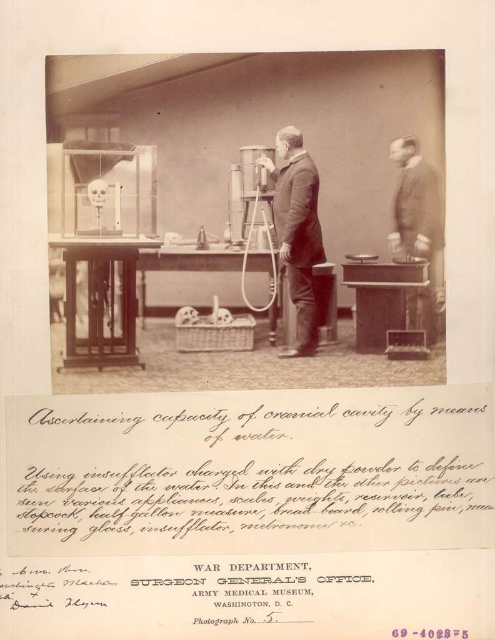
Question: Which is farther from the matte black box at center?

Choices:
 (A) smooth suit at center
 (B) matte black suit at right

Answer: (A)

Question: Does smooth suit at center appear on the left side of matte black box at center?

Choices:
 (A) no
 (B) yes

Answer: (B)

Question: In this image, where is smooth suit at center located relative to matte black box at center?

Choices:
 (A) right
 (B) left

Answer: (B)

Question: Which point is closer to the camera?

Choices:
 (A) (442, 301)
 (B) (306, 164)
 (C) (410, 314)

Answer: (A)

Question: Which object is closer to the camera taking this photo?

Choices:
 (A) matte black box at center
 (B) matte black suit at right

Answer: (B)

Question: Where is smooth suit at center located in relation to matte black box at center in the image?

Choices:
 (A) right
 (B) left

Answer: (B)